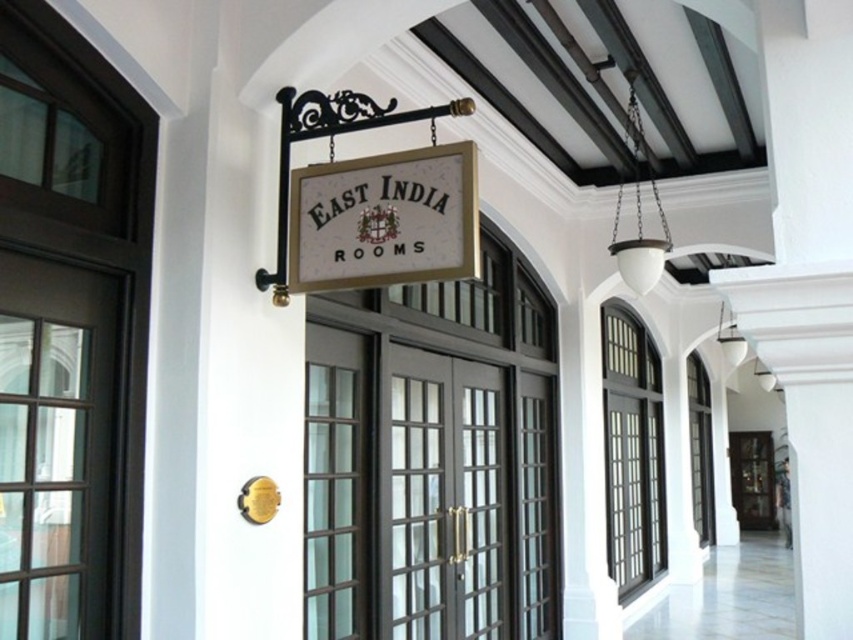
Looking at this image, you are standing at the entrance of the East India Rooms and need to find the matte black door at center. According to the coordinates provided, where exactly is the matte black door located?

The matte black door at center is located at point (445, 497).

You are standing at the entrance of East India Rooms and want to take a photo. There are two points marked in the scene, point 1 at coordinates point (502, 536) and point 2 at coordinates point (437, 209). If you want to focus on the closer point to the camera, which point should you choose?

Point (437, 209) is closer to the camera than point (502, 536), so you should focus on point (437, 209).

You are standing at the entrance of East India Rooms and want to take a photo of the hanging sign with the elegant lettering. The camera you are holding is at point (x=474, y=621). Is the camera close enough to capture the sign clearly?

The distance between the camera and point (x=474, y=621) is 17.46 feet. Since the camera is at that point, it means the camera is exactly at the location where the sign is, so it can capture the sign clearly.